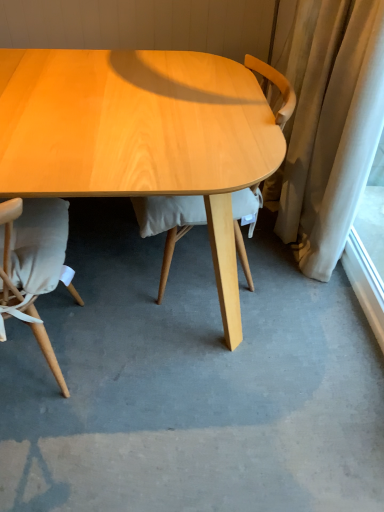
Locate an element on the screen. The height and width of the screenshot is (512, 384). vacant space to the right of matte beige chair at lower left, the 1th chair in the left-to-right sequence is located at coordinates (146, 375).